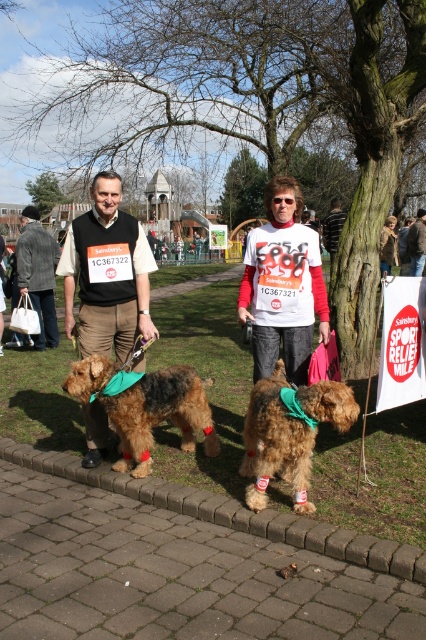
Is white/red long-sleeved shirt at center smaller than dark brown woolen jacket at left?

No, white/red long-sleeved shirt at center is not smaller than dark brown woolen jacket at left.

Does white/red long-sleeved shirt at center appear on the right side of dark brown woolen jacket at left?

Yes, white/red long-sleeved shirt at center is to the right of dark brown woolen jacket at left.

At what (x,y) coordinates should I click in order to perform the action: click on white/red long-sleeved shirt at center. Please return your answer as a coordinate pair (x, y). This screenshot has height=640, width=426. Looking at the image, I should click on (282, 284).

Image resolution: width=426 pixels, height=640 pixels. In order to click on white/red long-sleeved shirt at center in this screenshot , I will do `click(282, 284)`.

Between dark brown woolen jacket at left and matte white t-shirt at center, which one is positioned lower?

dark brown woolen jacket at left is below.

You are a GUI agent. You are given a task and a screenshot of the screen. Output one action in this format:
    pyautogui.click(x=<x>, y=<y>)
    Task: Click on the dark brown woolen jacket at left
    The height and width of the screenshot is (640, 426).
    Given the screenshot: What is the action you would take?
    pyautogui.click(x=37, y=273)

Can you confirm if brown furry dog at center is thinner than brown shaggy dog at center?

Correct, brown furry dog at center's width is less than brown shaggy dog at center's.

Between brown furry dog at center and brown shaggy dog at center, which one has less height?

brown shaggy dog at center is shorter.

Who is more distant from viewer, [293,404] or [207,433]?

The point [207,433] is more distant.

The width and height of the screenshot is (426, 640). What are the coordinates of `brown furry dog at center` in the screenshot? It's located at (290, 433).